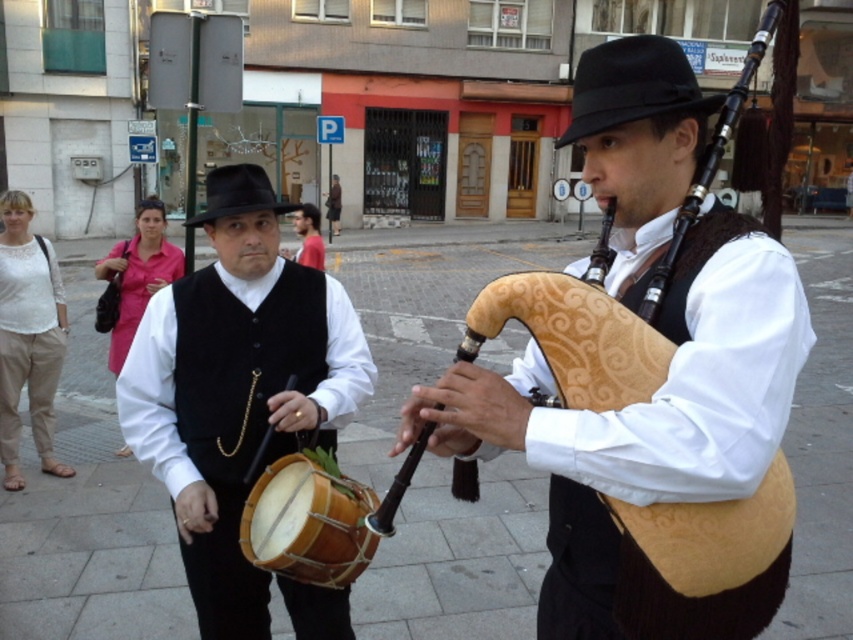
You are a photographer trying to capture the performer playing the bagpipe and the drummer in the background. You notice two points marked on your camera screen at coordinates point (85, 564) and point (212, 184). Which point is closer to the camera?

Point (85, 564) is further to the viewer than point (212, 184), so the point closer to the camera is point (212, 184).

You are standing on the gray stone pavement at center and looking towards the matte black vest at center. Which object is higher in elevation?

The gray stone pavement at center is much taller than the matte black vest at center, so the gray stone pavement at center is higher in elevation.

You are a photographer standing at the center of the street. You need to capture a photo that includes both the person playing the bagpipe and the person holding the drum. However, there is a light pole at point (28, 337) that might block your view. Based on the scene description, can you determine if the light pole will block your view of the matte white blouse at left?

The point (28, 337) marks the matte white blouse at left, so the light pole is not blocking the view of the matte white blouse at left because the point indicates the blouse itself is located there.